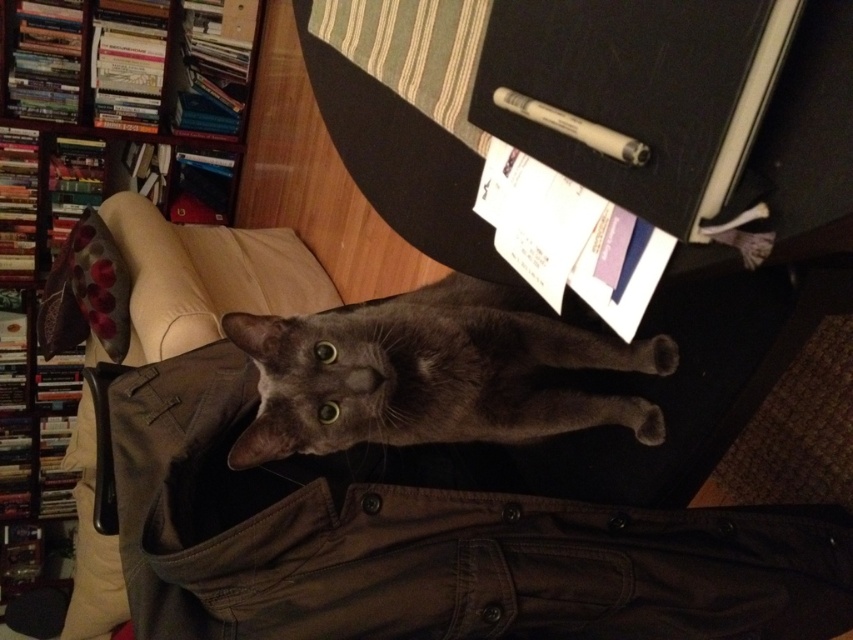
Does dark brown fabric pocket at center have a smaller size compared to shiny gray cat at center?

Actually, dark brown fabric pocket at center might be larger than shiny gray cat at center.

Is dark brown fabric pocket at center below shiny gray cat at center?

Correct, dark brown fabric pocket at center is located below shiny gray cat at center.

Which is behind, point (686, 588) or point (604, 403)?

Positioned behind is point (604, 403).

You are a GUI agent. You are given a task and a screenshot of the screen. Output one action in this format:
    pyautogui.click(x=<x>, y=<y>)
    Task: Click on the dark brown fabric pocket at center
    The width and height of the screenshot is (853, 640).
    Given the screenshot: What is the action you would take?
    428,540

Between point (419, 417) and point (167, 51), which one is positioned behind?

The point (167, 51) is behind.

Describe the element at coordinates (431, 372) in the screenshot. I see `shiny gray cat at center` at that location.

Does point (323, 364) lie in front of point (135, 6)?

That is True.

Where is `shiny gray cat at center`? shiny gray cat at center is located at coordinates (431, 372).

Find the location of a particular element. dark brown fabric pocket at center is located at coordinates (428, 540).

Between point (273, 576) and point (39, 58), which one is positioned behind?

Point (39, 58)

Identify the location of dark brown fabric pocket at center. The height and width of the screenshot is (640, 853). (428, 540).